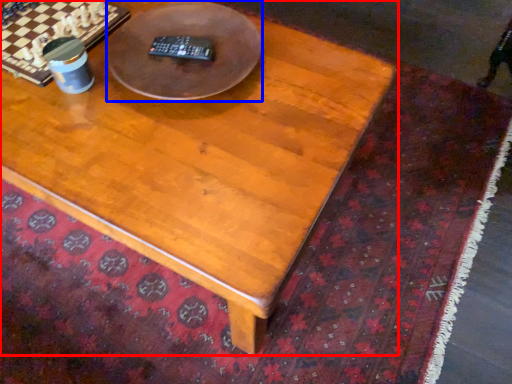
Question: Which of the following is the closest to the observer, coffee table (highlighted by a red box) or round table (highlighted by a blue box)?

Choices:
 (A) coffee table
 (B) round table

Answer: (A)